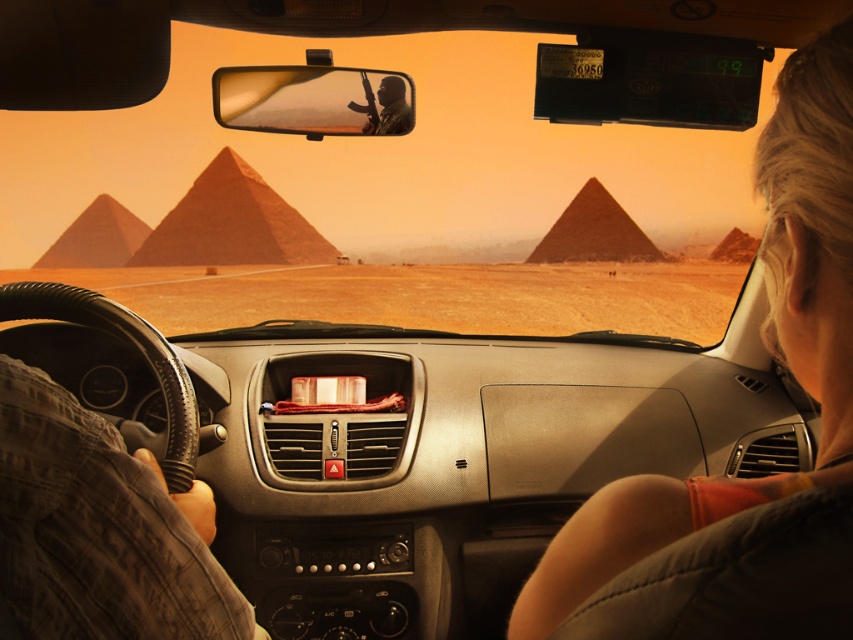
You are sitting in the passenger seat of the car and want to reach two points inside the car. The first point is at coordinate point(816, 356) and the second is at point(299, 262). Which point is closer to you?

Point(816, 356) is in front of point(299, 262), so the second point at point(299, 262) is closer to you.

You are sitting in the car and need to place a rectangular object that is 10 cm wide. You have two options for placement on the dashboard or near the steering wheel. The gray fabric sleeve at lower left and the reddish sandstone pyramid at center are visible. Which object can accommodate the object based on their widths?

The reddish sandstone pyramid at center has a greater width than the gray fabric sleeve at lower left, so the rectangular object can fit on the reddish sandstone pyramid at center.